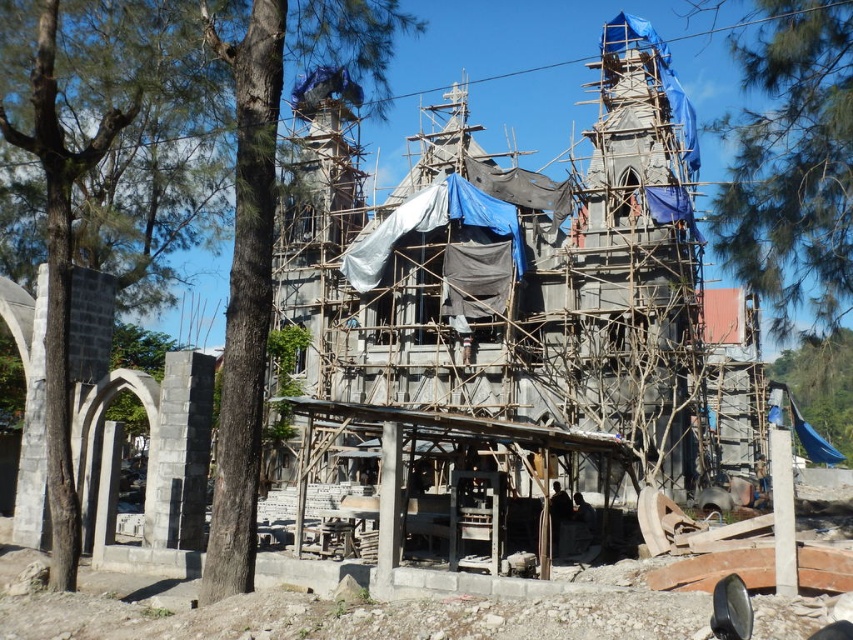
Question: Which of the following is the farthest from the observer?

Choices:
 (A) (61, 20)
 (B) (773, 284)

Answer: (B)

Question: From the image, what is the correct spatial relationship of green leafy tree at left in relation to green leafy tree at upper right?

Choices:
 (A) below
 (B) above

Answer: (B)

Question: Does green leafy tree at left appear under green leafy tree at upper right?

Choices:
 (A) no
 (B) yes

Answer: (A)

Question: Is green leafy tree at left closer to the viewer compared to green leafy tree at upper right?

Choices:
 (A) yes
 (B) no

Answer: (A)

Question: Which point appears closest to the camera in this image?

Choices:
 (A) (753, 173)
 (B) (260, 13)

Answer: (B)

Question: Which of the following is the closest to the observer?

Choices:
 (A) (309, 20)
 (B) (780, 160)

Answer: (A)